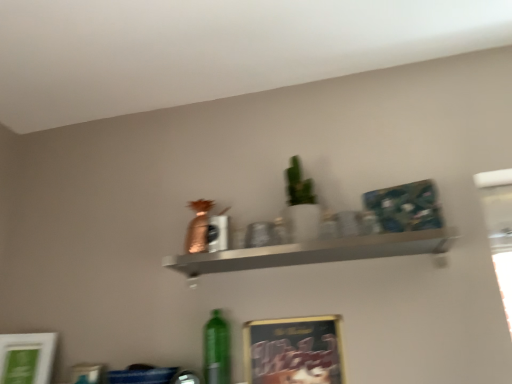
Question: Can we say metallic silver shelf at center lies outside white matte picture frame at lower left, the first picture frame from the left?

Choices:
 (A) no
 (B) yes

Answer: (B)

Question: Does metallic silver shelf at center have a lesser width compared to white matte picture frame at lower left, the 2th picture frame when ordered from right to left?

Choices:
 (A) no
 (B) yes

Answer: (A)

Question: Considering the relative sizes of metallic silver shelf at center and white matte picture frame at lower left, the 2th picture frame when ordered from right to left, in the image provided, is metallic silver shelf at center shorter than white matte picture frame at lower left, the 2th picture frame when ordered from right to left,?

Choices:
 (A) yes
 (B) no

Answer: (A)

Question: From a real-world perspective, is metallic silver shelf at center positioned over white matte picture frame at lower left, the first picture frame from the left, based on gravity?

Choices:
 (A) yes
 (B) no

Answer: (A)

Question: Would you say metallic silver shelf at center contains white matte picture frame at lower left, the 2th picture frame when ordered from right to left?

Choices:
 (A) no
 (B) yes

Answer: (A)

Question: Considering the relative positions of metallic silver shelf at center and white matte picture frame at lower left, the first picture frame from the left, in the image provided, is metallic silver shelf at center behind white matte picture frame at lower left, the first picture frame from the left,?

Choices:
 (A) no
 (B) yes

Answer: (A)

Question: Considering the relative sizes of metallic gold picture frame at lower center, which is the 2th picture frame in left-to-right order, and white matte picture frame at lower left, the 2th picture frame when ordered from right to left, in the image provided, is metallic gold picture frame at lower center, which is the 2th picture frame in left-to-right order, wider than white matte picture frame at lower left, the 2th picture frame when ordered from right to left,?

Choices:
 (A) yes
 (B) no

Answer: (B)

Question: Is metallic gold picture frame at lower center, which is the 2th picture frame in left-to-right order, at the right side of white matte picture frame at lower left, the 2th picture frame when ordered from right to left?

Choices:
 (A) no
 (B) yes

Answer: (B)

Question: From the image's perspective, is metallic gold picture frame at lower center, marked as the 1th picture frame in a right-to-left arrangement, over white matte picture frame at lower left, the first picture frame from the left?

Choices:
 (A) yes
 (B) no

Answer: (B)

Question: Is metallic gold picture frame at lower center, which is the 2th picture frame in left-to-right order, closer to camera compared to white matte picture frame at lower left, the first picture frame from the left?

Choices:
 (A) yes
 (B) no

Answer: (A)

Question: Considering the relative sizes of metallic gold picture frame at lower center, which is the 2th picture frame in left-to-right order, and white matte picture frame at lower left, the 2th picture frame when ordered from right to left, in the image provided, is metallic gold picture frame at lower center, which is the 2th picture frame in left-to-right order, smaller than white matte picture frame at lower left, the 2th picture frame when ordered from right to left,?

Choices:
 (A) no
 (B) yes

Answer: (B)

Question: Does metallic gold picture frame at lower center, which is the 2th picture frame in left-to-right order, have a lesser height compared to white matte picture frame at lower left, the 2th picture frame when ordered from right to left?

Choices:
 (A) yes
 (B) no

Answer: (B)

Question: Is metallic gold picture frame at lower center, marked as the 1th picture frame in a right-to-left arrangement, at the back of metallic silver shelf at center?

Choices:
 (A) no
 (B) yes

Answer: (A)